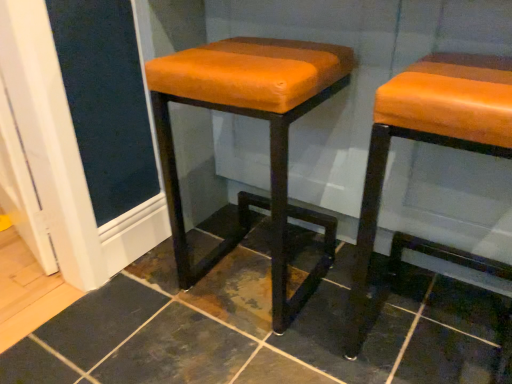
Locate an element on the screen. The height and width of the screenshot is (384, 512). unoccupied area in front of orange leather stool at center, which ranks as the first stool in left-to-right order is located at coordinates (244, 354).